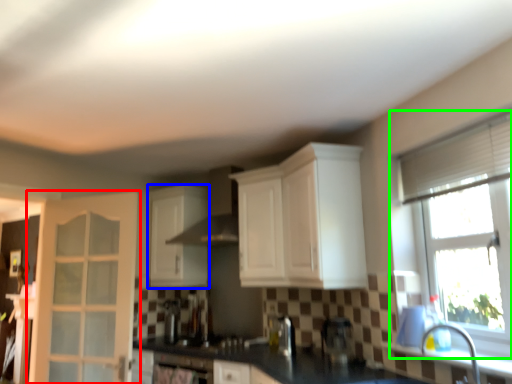
Question: Which object is the farthest from door (highlighted by a red box)? Choose among these: cabinetry (highlighted by a blue box) or window (highlighted by a green box).

Choices:
 (A) cabinetry
 (B) window

Answer: (B)